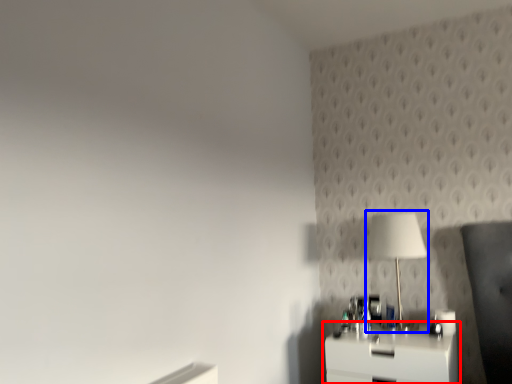
Question: Among these objects, which one is farthest to the camera, nightstand (highlighted by a red box) or table lamp (highlighted by a blue box)?

Choices:
 (A) nightstand
 (B) table lamp

Answer: (B)